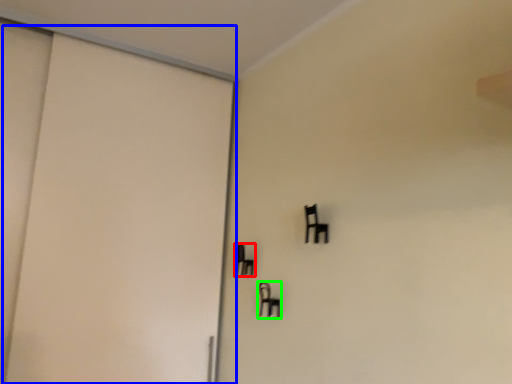
Question: Estimate the real-world distances between objects in this image. Which object is closer to furniture (highlighted by a red box), door (highlighted by a blue box) or furniture (highlighted by a green box)?

Choices:
 (A) door
 (B) furniture

Answer: (B)